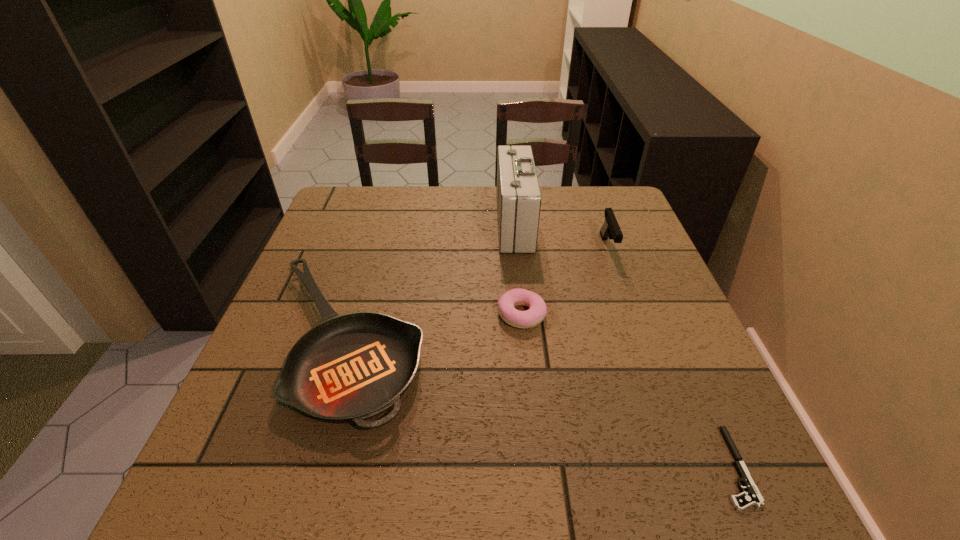
This screenshot has height=540, width=960. I want to click on the tallest object, so click(x=518, y=196).

The height and width of the screenshot is (540, 960). In order to click on the fourth object from left to right in this screenshot , I will do `click(610, 228)`.

Image resolution: width=960 pixels, height=540 pixels. Find the location of `the farther pistol`. the farther pistol is located at coordinates (610, 228).

Identify the location of the leftmost object. (352, 367).

Locate an element on the screen. This screenshot has width=960, height=540. pastry is located at coordinates (506, 304).

I want to click on the nearer pistol, so click(x=752, y=496).

The width and height of the screenshot is (960, 540). Find the location of `the shortest object`. the shortest object is located at coordinates (752, 496).

The height and width of the screenshot is (540, 960). In order to click on blank area located on the front-facing side of the first-aid kit in this screenshot , I will do `click(368, 224)`.

Identify the location of free spot located 0.080m on the front-facing side of the first-aid kit. This screenshot has height=540, width=960. (469, 224).

What are the coordinates of `vacant space located 0.250m on the front-facing side of the first-aid kit` in the screenshot? It's located at (410, 224).